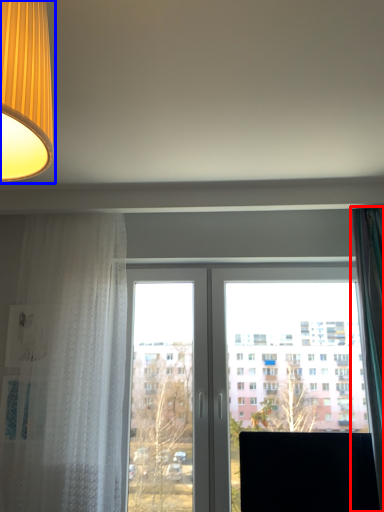
Question: Among these objects, which one is farthest to the camera, curtain (highlighted by a red box) or lamp (highlighted by a blue box)?

Choices:
 (A) curtain
 (B) lamp

Answer: (A)